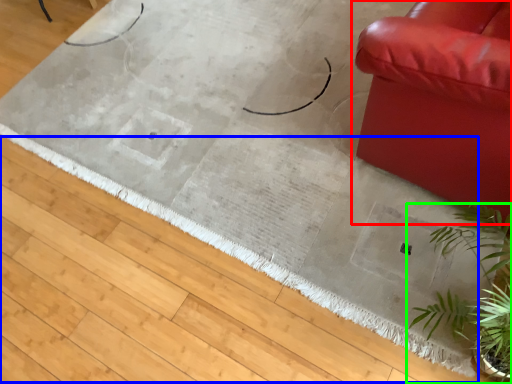
Question: Considering the real-world distances, which object is closest to studio couch (highlighted by a red box)? doormat (highlighted by a blue box) or houseplant (highlighted by a green box).

Choices:
 (A) doormat
 (B) houseplant

Answer: (B)